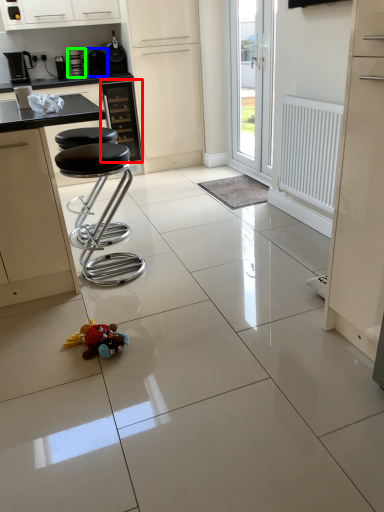
Question: Considering the real-world distances, which object is farthest from cabinetry (highlighted by a red box)? appliance (highlighted by a blue box) or coffee machine (highlighted by a green box)?

Choices:
 (A) appliance
 (B) coffee machine

Answer: (B)